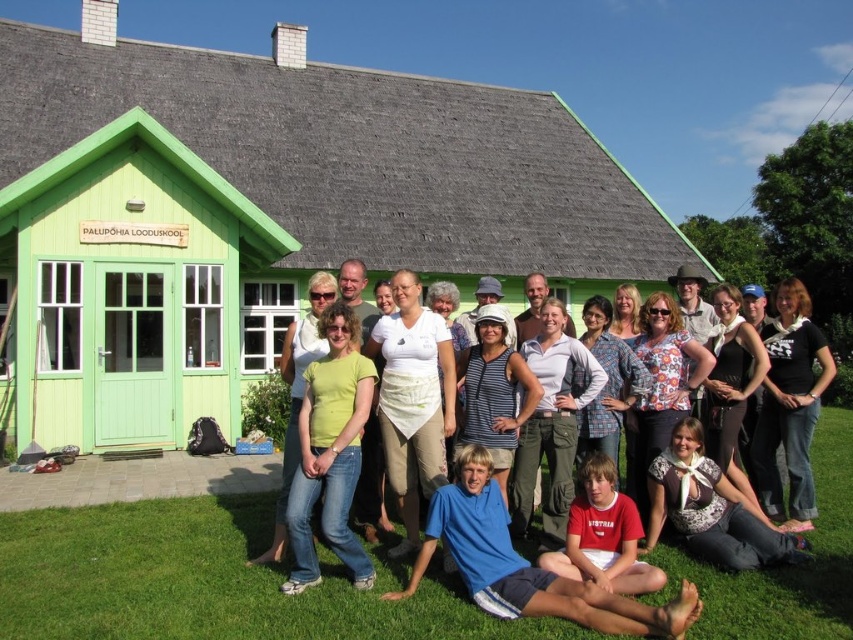
Is green grass at lower center thinner than red cotton shirt at lower center?

In fact, green grass at lower center might be wider than red cotton shirt at lower center.

Is point (767, 579) in front of point (601, 564)?

No, (767, 579) is behind (601, 564).

Identify the location of green grass at lower center. This screenshot has height=640, width=853. (207, 580).

Is green wooden hut at center behind white cotton shirt at center?

Yes, it is behind white cotton shirt at center.

Which is more to the right, green wooden hut at center or white cotton shirt at center?

white cotton shirt at center

Find the location of a particular element. This screenshot has width=853, height=640. green wooden hut at center is located at coordinates (260, 214).

Based on the photo, between green wooden hut at center and green grass at lower center, which one has less height?

Standing shorter between the two is green grass at lower center.

Can you confirm if green wooden hut at center is positioned to the left of green grass at lower center?

Indeed, green wooden hut at center is positioned on the left side of green grass at lower center.

Describe the element at coordinates (260, 214) in the screenshot. I see `green wooden hut at center` at that location.

Where is `green wooden hut at center`? green wooden hut at center is located at coordinates (260, 214).